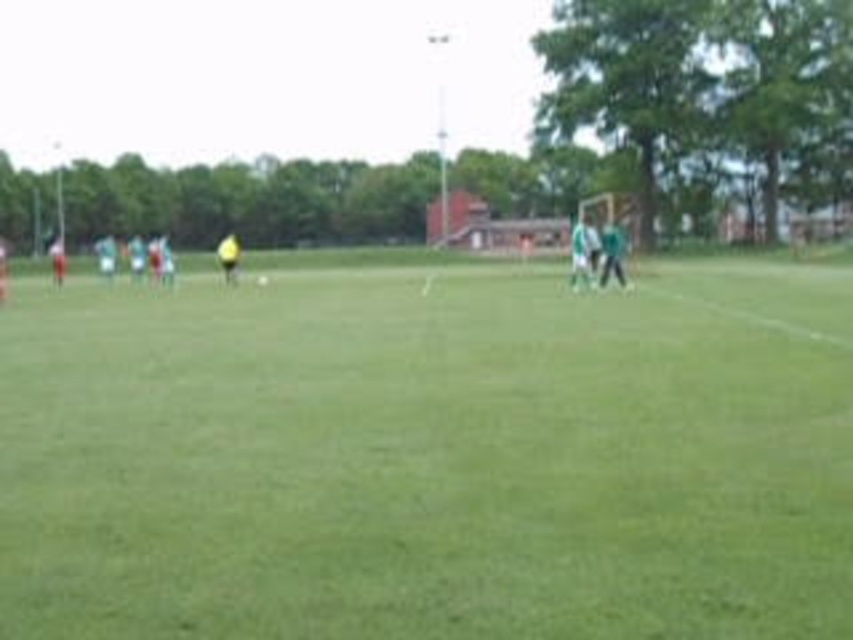
Question: Can you confirm if green matte shirt at right is wider than yellow jersey at left?

Choices:
 (A) no
 (B) yes

Answer: (A)

Question: Can you confirm if green jersey at right is bigger than yellow jersey at left?

Choices:
 (A) no
 (B) yes

Answer: (A)

Question: Which object is farther from the camera taking this photo?

Choices:
 (A) green jersey at right
 (B) green grass field at center
 (C) yellow jersey at left
 (D) white matte soccer player at left

Answer: (D)

Question: Among these objects, which one is farthest from the camera?

Choices:
 (A) white matte soccer player at left
 (B) yellow jersey at left
 (C) yellow matte soccer ball at center

Answer: (A)

Question: Which object is closer to the camera taking this photo?

Choices:
 (A) green jersey at right
 (B) yellow jersey at left
 (C) green matte shirt at right

Answer: (A)

Question: Is green matte shirt at right smaller than yellow jersey at left?

Choices:
 (A) no
 (B) yes

Answer: (B)